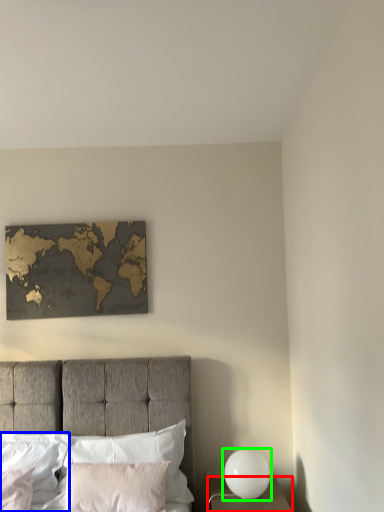
Question: Based on their relative distances, which object is nearer to nightstand (highlighted by a red box)? Choose from pillow (highlighted by a blue box) and bedside lamp (highlighted by a green box).

Choices:
 (A) pillow
 (B) bedside lamp

Answer: (B)